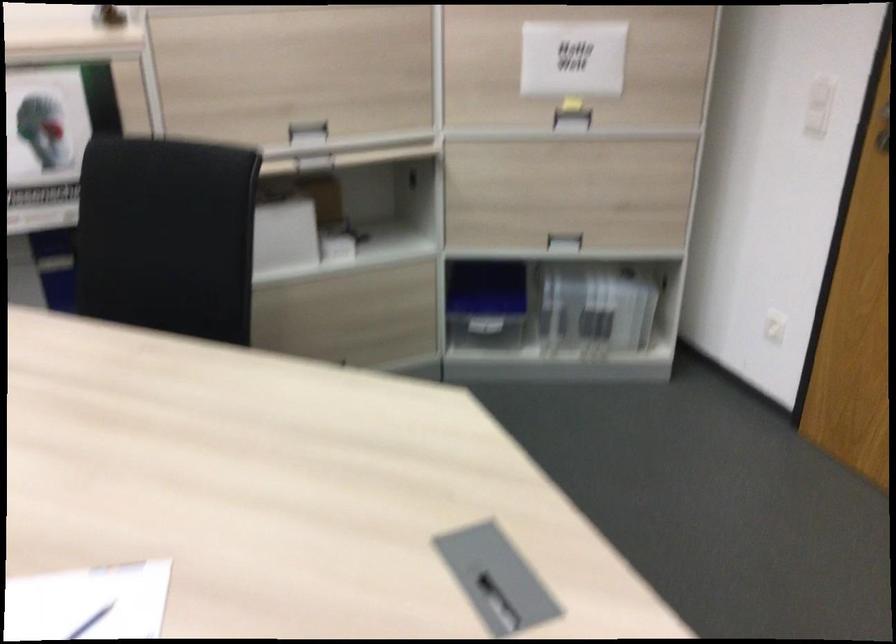
Which object does [486,303] point to?

It corresponds to the blue plastic container in the image.